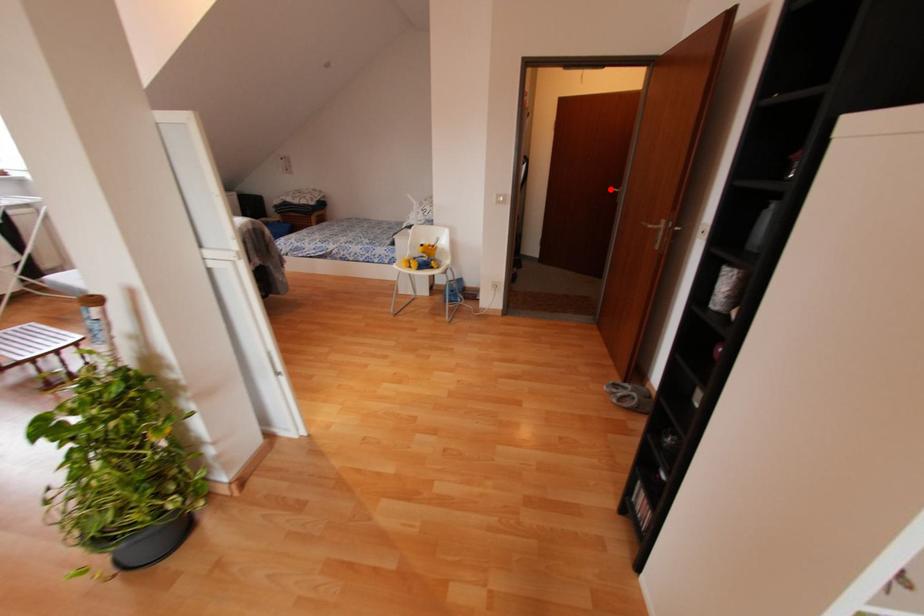
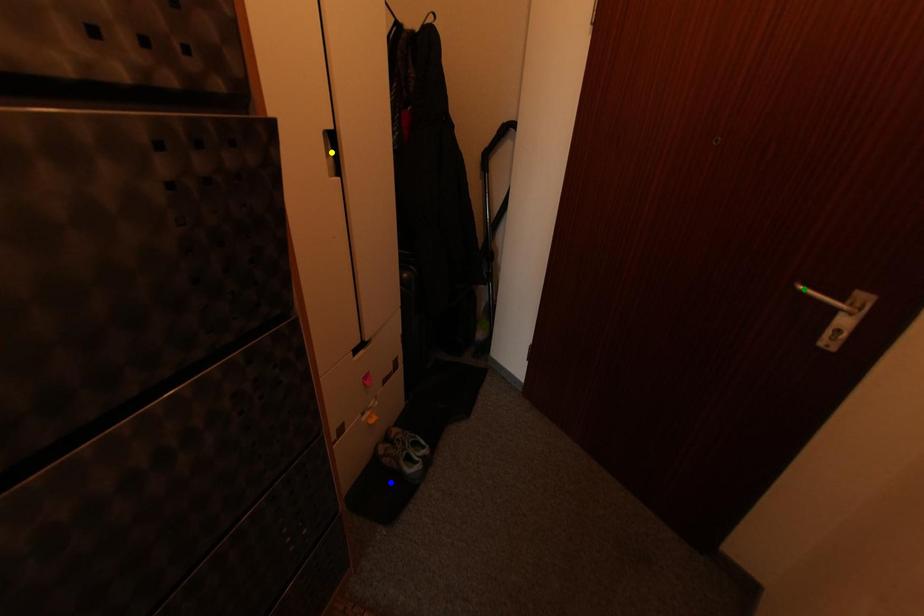
Question: I am providing you with two images of the same scene from different viewpoints. A red point is marked on the first image. You are given multiple points on the second image. In image 2, which mark is for the same physical point as the one in image 1?

Choices:
 (A) blue point
 (B) green point
 (C) yellow point

Answer: (B)